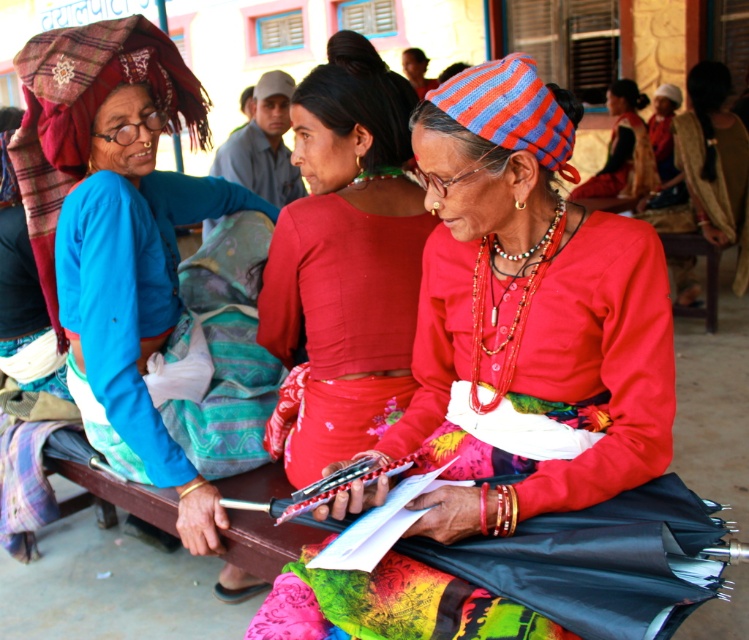
From the picture: Does matte blue shirt at left have a larger size compared to matte red blouse at center?

Indeed, matte blue shirt at left has a larger size compared to matte red blouse at center.

Does matte blue shirt at left appear over matte red blouse at center?

Actually, matte blue shirt at left is below matte red blouse at center.

Between point (139, 225) and point (318, 228), which one is positioned in front?

Point (318, 228)

The height and width of the screenshot is (640, 749). What are the coordinates of `matte blue shirt at left` in the screenshot? It's located at (118, 224).

Does point (76, 257) lie behind point (643, 189)?

No, (76, 257) is in front of (643, 189).

What do you see at coordinates (118, 224) in the screenshot? I see `matte blue shirt at left` at bounding box center [118, 224].

Is point (209, 513) farther from viewer compared to point (618, 148)?

That is False.

This screenshot has width=749, height=640. I want to click on matte blue shirt at left, so click(x=118, y=224).

Is gold textured shawl at center above red fabric skirt at center?

No, gold textured shawl at center is not above red fabric skirt at center.

Does gold textured shawl at center have a greater width compared to red fabric skirt at center?

No.

Between point (742, 237) and point (631, 180), which one is positioned behind?

Point (631, 180)

The height and width of the screenshot is (640, 749). I want to click on gold textured shawl at center, so click(x=715, y=161).